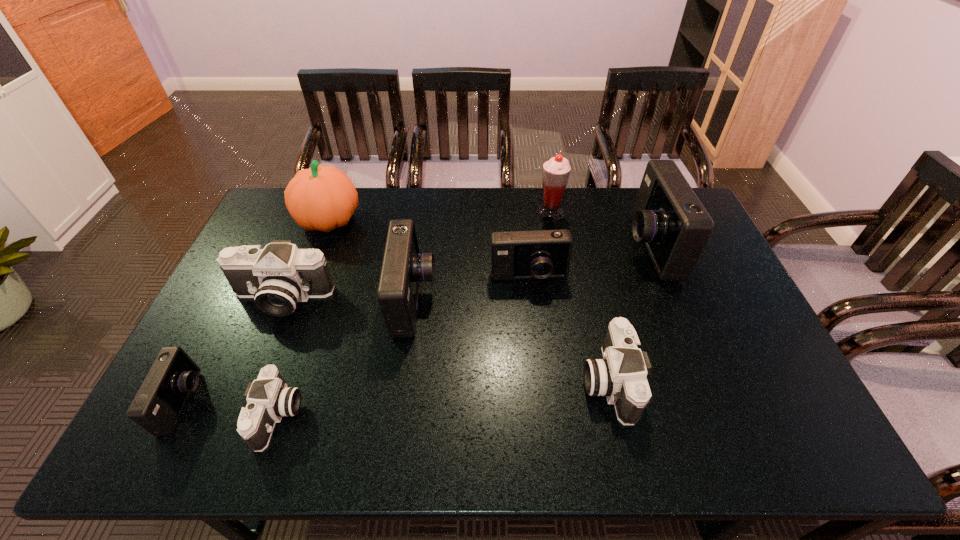
Where is `the leftmost blue camera`? This screenshot has height=540, width=960. the leftmost blue camera is located at coordinates (159, 402).

I want to click on the smallest black camera, so click(x=269, y=398).

Locate an element on the screen. The height and width of the screenshot is (540, 960). free region located 0.300m on the right of the smoothie is located at coordinates (647, 213).

Find the location of a particular element. vacant area situated on the right of the orange pumpkin is located at coordinates (458, 221).

Locate an element on the screen. vacant point located 0.240m on the front-facing side of the rightmost camera is located at coordinates (553, 247).

Locate an element on the screen. Image resolution: width=960 pixels, height=540 pixels. vacant region located on the front-facing side of the rightmost camera is located at coordinates (514, 247).

The image size is (960, 540). In order to click on blank space located on the front-facing side of the rightmost camera in this screenshot , I will do `click(559, 247)`.

This screenshot has height=540, width=960. What are the coordinates of `free space located on the front-facing side of the fourth camera from left to right` in the screenshot? It's located at pos(514,300).

Where is `vacant space located 0.270m on the front of the biggest black camera`? This screenshot has height=540, width=960. vacant space located 0.270m on the front of the biggest black camera is located at coordinates (235, 408).

At what (x,y) coordinates should I click in order to perform the action: click on vacant area located on the front-facing side of the third blue camera from left to right. Please return your answer as a coordinate pair (x, y). The height and width of the screenshot is (540, 960). Looking at the image, I should click on (542, 407).